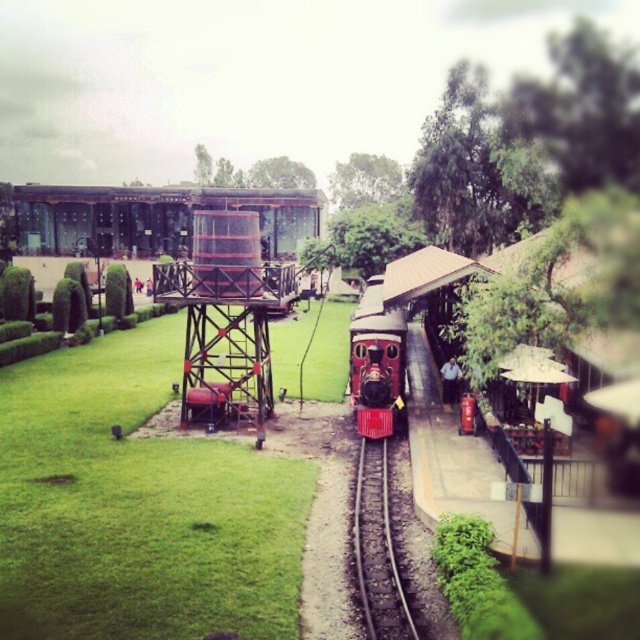
Question: In this image, where is black metal train track at center located relative to shiny red locomotive at center?

Choices:
 (A) above
 (B) below

Answer: (B)

Question: Can you confirm if black metal train track at center is positioned to the left of shiny red locomotive at center?

Choices:
 (A) no
 (B) yes

Answer: (B)

Question: Which object appears farthest from the camera in this image?

Choices:
 (A) shiny red locomotive at center
 (B) black metal train track at center

Answer: (A)

Question: Which point is closer to the camera taking this photo?

Choices:
 (A) (368, 346)
 (B) (374, 444)

Answer: (B)

Question: Where is black metal train track at center located in relation to shiny red locomotive at center in the image?

Choices:
 (A) left
 (B) right

Answer: (A)

Question: Which point is closer to the camera?

Choices:
 (A) [358, 353]
 (B) [372, 522]

Answer: (B)